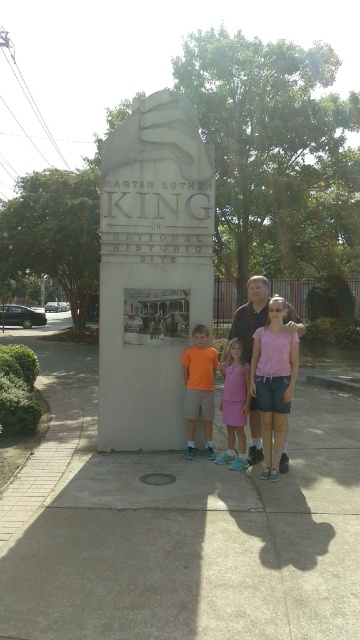
Describe the element at coordinates (183, 531) in the screenshot. I see `concrete at center` at that location.

Does point (284, 502) lie in front of point (255, 365)?

Yes, point (284, 502) is closer to viewer.

Locate an element on the screen. concrete at center is located at coordinates (183, 531).

Looking at this image, is concrete at center smaller than pink fabric dress at center?

No.

Measure the distance between point [145,566] and camera.

A distance of 3.56 meters exists between point [145,566] and camera.

Which is in front, point (168, 461) or point (237, 442)?

Point (168, 461)

Where is `concrete at center`? This screenshot has height=640, width=360. concrete at center is located at coordinates (183, 531).

Is matte black shirt at center bigger than orange cotton shirt at lower center?

Indeed, matte black shirt at center has a larger size compared to orange cotton shirt at lower center.

Does point (297, 326) come in front of point (204, 419)?

Yes, it is in front of point (204, 419).

This screenshot has height=640, width=360. In order to click on matte black shirt at center in this screenshot , I will do `click(249, 316)`.